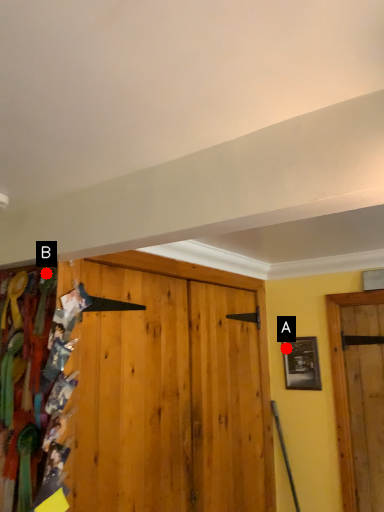
Question: Two points are circled on the image, labeled by A and B beside each circle. Which of the following is the farthest from the observer?

Choices:
 (A) A is further
 (B) B is further

Answer: (A)